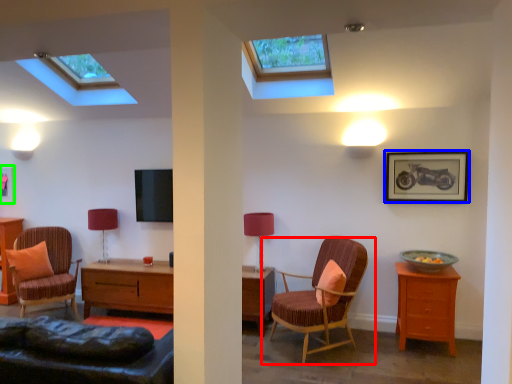
Question: Based on their relative distances, which object is nearer to chair (highlighted by a red box)? Choose from picture frame (highlighted by a blue box) and picture frame (highlighted by a green box).

Choices:
 (A) picture frame
 (B) picture frame

Answer: (A)